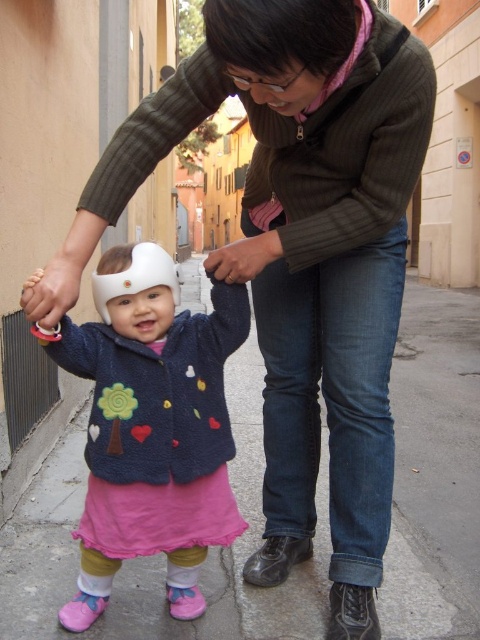
Based on the scene description, where is the matte white helmet at upper left located in the image?

The matte white helmet at upper left is located at point (50,292) in the image.

You are a fashion designer observing the scene. You notice the fuzzy blue jacket at center and the matte brown hand at center. Which object would you say is larger in size?

The fuzzy blue jacket at center is bigger than the matte brown hand at center, so the fuzzy blue jacket at center is larger in size.

You are a delivery person who needs to deliver a package to the address shown in the image. The package requires that you maintain a minimum distance of 18 inches between the package and any obstacles. Based on the scene, can you safely place the package between the matte white helmet at upper left and the matte brown hand at center?

The distance between the matte white helmet at upper left and the matte brown hand at center is 17.62 inches, which is less than the required 18 inches. Therefore, you cannot safely place the package between them due to insufficient space.